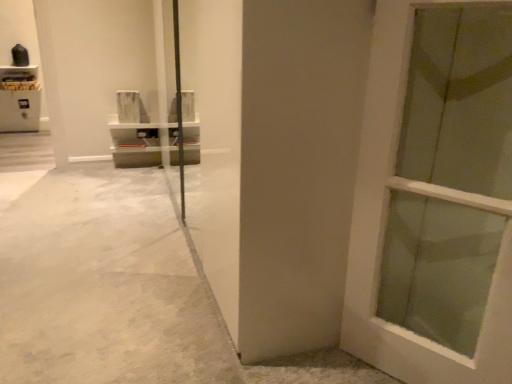
Question: In the image, is wooden shelf at upper left positioned in front of or behind white polished concrete at center?

Choices:
 (A) behind
 (B) front

Answer: (A)

Question: From the image's perspective, relative to white polished concrete at center, is wooden shelf at upper left above or below?

Choices:
 (A) above
 (B) below

Answer: (A)

Question: Which object is positioned farthest from the white matte door at center?

Choices:
 (A) wooden shelf at upper left
 (B) white polished concrete at center

Answer: (A)

Question: Estimate the real-world distances between objects in this image. Which object is farther from the white matte door at center?

Choices:
 (A) white polished concrete at center
 (B) wooden shelf at upper left

Answer: (B)